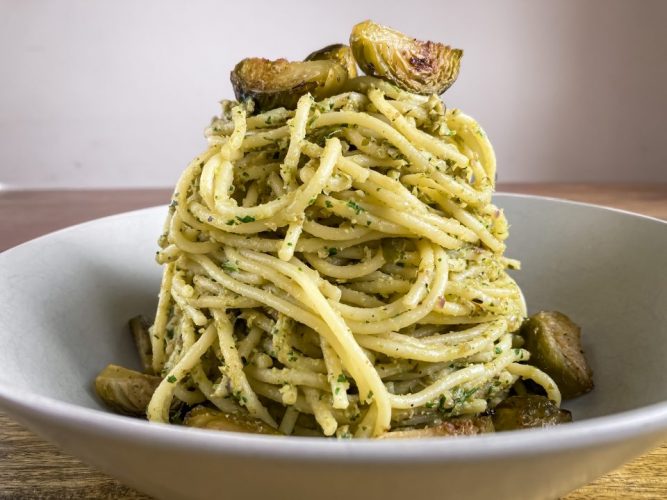
Find the location of a particular element. The width and height of the screenshot is (667, 500). wall is located at coordinates (167, 51).